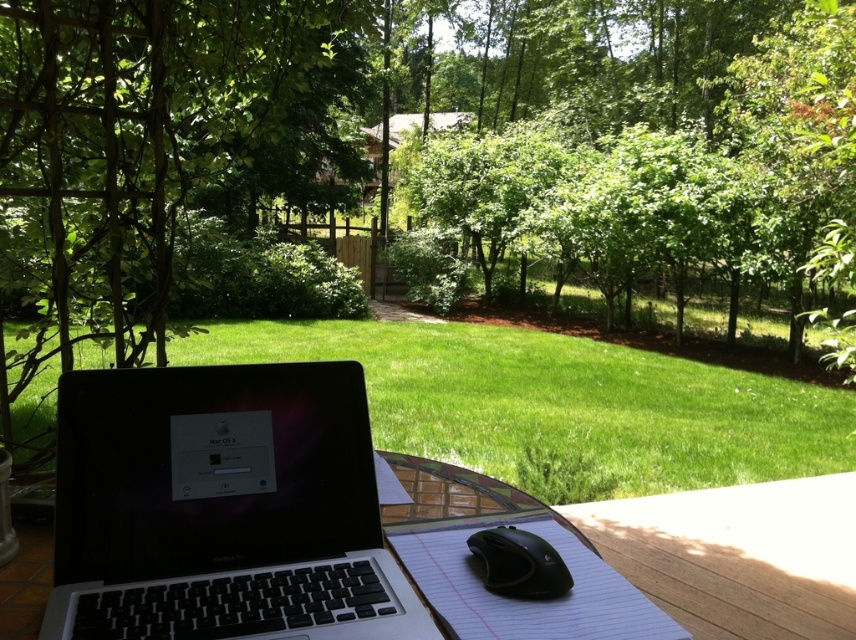
Between white lined notebook at center and black rubberized mouse at lower center, which one has less height?

white lined notebook at center is shorter.

Between point (611, 621) and point (522, 529), which one is positioned behind?

Point (522, 529)

Between point (601, 580) and point (538, 538), which one is positioned behind?

Point (538, 538)

Where is `white lined notebook at center`? This screenshot has width=856, height=640. white lined notebook at center is located at coordinates (522, 600).

Does green leafy tree at upper center have a lesser width compared to white lined notebook at center?

Incorrect, green leafy tree at upper center's width is not less than white lined notebook at center's.

Between point (642, 112) and point (476, 612), which one is positioned behind?

The point (642, 112) is behind.

This screenshot has height=640, width=856. I want to click on green leafy tree at upper center, so click(x=666, y=154).

Measure the distance between point (322, 563) and camera.

Point (322, 563) is 30.24 inches from camera.

Is point (227, 628) positioned in front of point (786, 538)?

That is True.

At what (x,y) coordinates should I click in order to perform the action: click on sleek black laptop at lower left. Please return your answer as a coordinate pair (x, y). The width and height of the screenshot is (856, 640). Looking at the image, I should click on (221, 508).